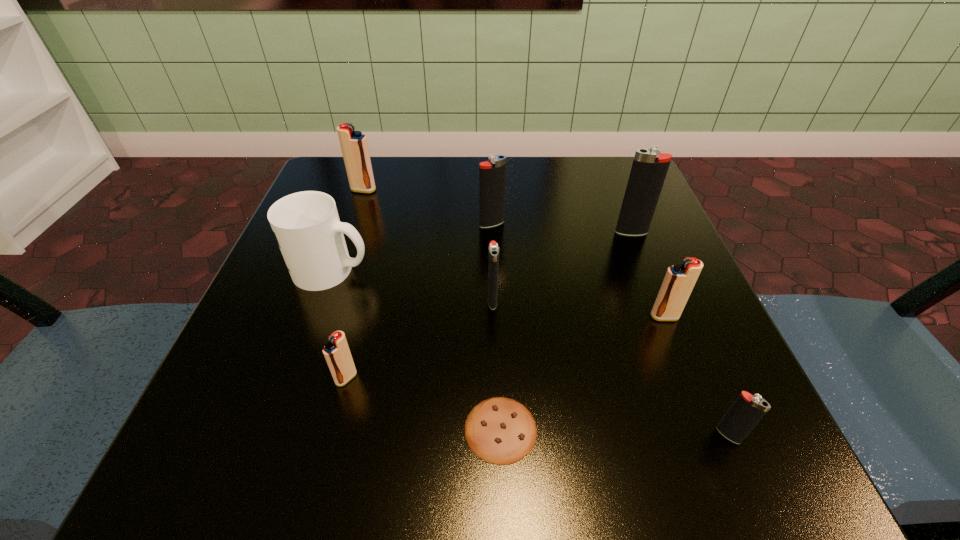
This screenshot has width=960, height=540. I want to click on the closest igniter relative to the cookie, so click(336, 352).

Choose which igniter is the nearest neighbor to the fourth farthest igniter. Please provide its 2D coordinates. Your answer should be formatted as a tuple, i.e. [(x, y)], where the tuple contains the x and y coordinates of a point satisfying the conditions above.

[(492, 176)]

Identify which black igniter is the third nearest to the sixth nearest object. Please provide its 2D coordinates. Your answer should be formatted as a tuple, i.e. [(x, y)], where the tuple contains the x and y coordinates of a point satisfying the conditions above.

[(649, 169)]

Identify which black igniter is located as the nearest to the third smallest black igniter. Please provide its 2D coordinates. Your answer should be formatted as a tuple, i.e. [(x, y)], where the tuple contains the x and y coordinates of a point satisfying the conditions above.

[(493, 254)]

Where is `red igniter that is the closest one to the fifth farthest object`? The image size is (960, 540). red igniter that is the closest one to the fifth farthest object is located at coordinates (336, 352).

At what (x,y) coordinates should I click in order to perform the action: click on red igniter that stands as the third closest to the second nearest black igniter. Please return your answer as a coordinate pair (x, y). Looking at the image, I should click on (354, 146).

Locate an element on the screen. This screenshot has width=960, height=540. vacant space that satisfies the following two spatial constraints: 1. on the back side of the second nearest black igniter; 2. on the handle side of the white mug is located at coordinates (492, 270).

Locate an element on the screen. Image resolution: width=960 pixels, height=540 pixels. free location that satisfies the following two spatial constraints: 1. on the handle side of the smallest black igniter; 2. on the left side of the white mug is located at coordinates (275, 435).

Locate an element on the screen. This screenshot has height=540, width=960. free space that satisfies the following two spatial constraints: 1. on the front side of the biggest red igniter; 2. on the handle side of the mug is located at coordinates (336, 270).

Where is `vacant space that satisfies the following two spatial constraints: 1. on the handle side of the second nearest black igniter; 2. on the right side of the mug`? This screenshot has height=540, width=960. vacant space that satisfies the following two spatial constraints: 1. on the handle side of the second nearest black igniter; 2. on the right side of the mug is located at coordinates (322, 301).